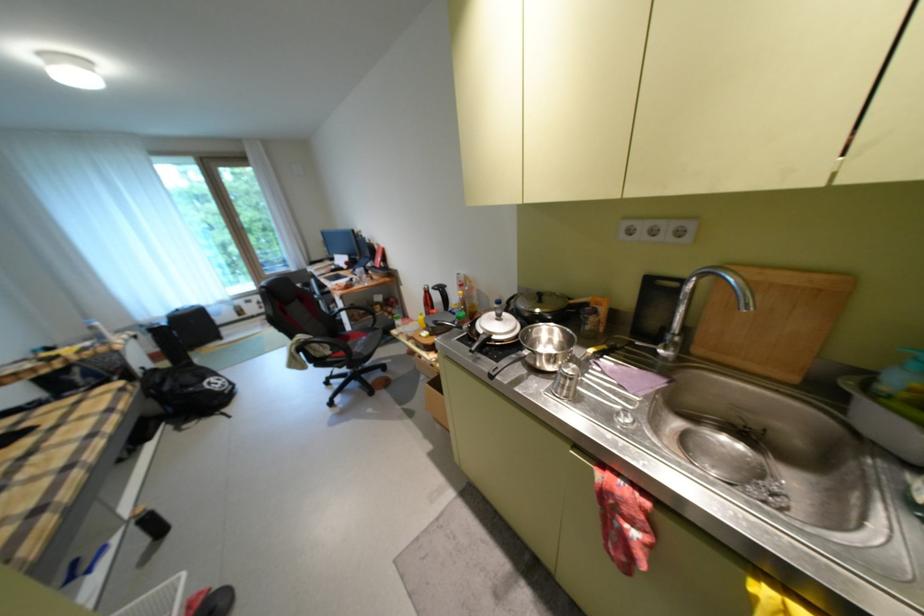
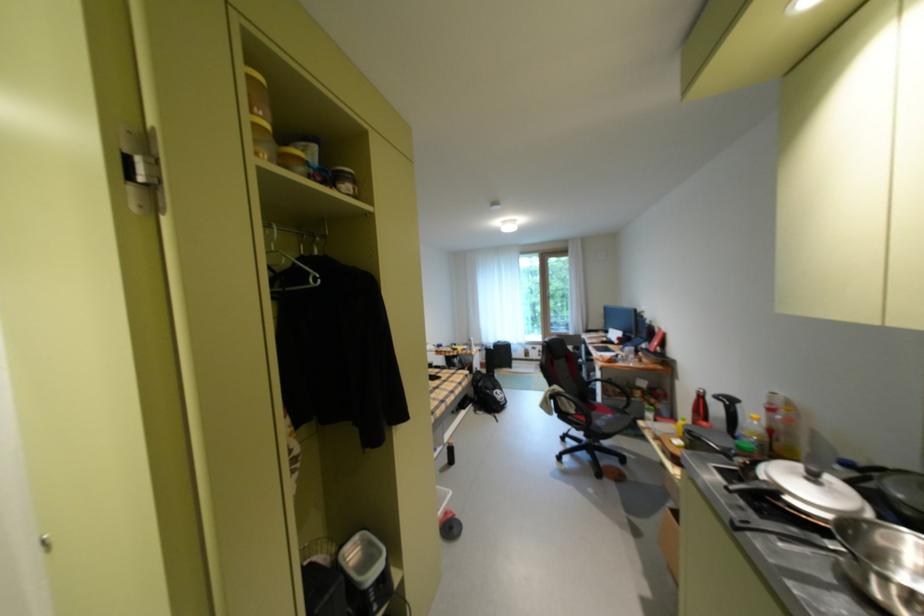
In the second image, find the point that corresponds to the point at 162,392 in the first image.

(484, 384)